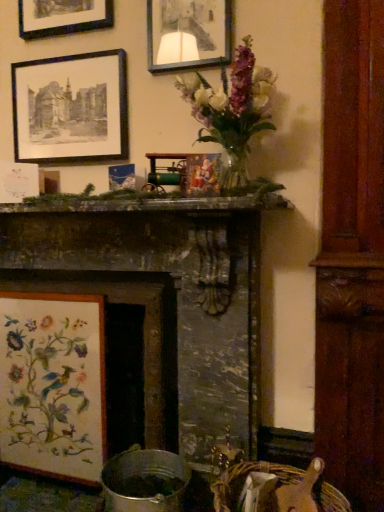
Question: Does point (342, 494) appear closer or farther from the camera than point (61, 355)?

Choices:
 (A) farther
 (B) closer

Answer: (B)

Question: From the image's perspective, is woven straw basket at lower right located above or below wooden floral embroidery at lower left, the first picture frame from the bottom?

Choices:
 (A) above
 (B) below

Answer: (B)

Question: Estimate the real-world distances between objects in this image. Which object is closer to the matte glass picture frame at upper center, which appears as the 1th picture frame when viewed from the top?

Choices:
 (A) dark gray stone fireplace at center
 (B) black paper picture frame at upper left, which is the 2th picture frame in top-to-bottom order
 (C) woven straw basket at lower right
 (D) wooden floral embroidery at lower left, the first picture frame from the bottom

Answer: (B)

Question: Estimate the real-world distances between objects in this image. Which object is farther from the dark gray stone fireplace at center?

Choices:
 (A) matte glass picture frame at upper center, which appears as the third picture frame when ordered from the bottom
 (B) black paper picture frame at upper left, acting as the 2th picture frame starting from the bottom
 (C) wooden floral embroidery at lower left, which appears as the 3th picture frame when viewed from the top
 (D) woven straw basket at lower right

Answer: (A)